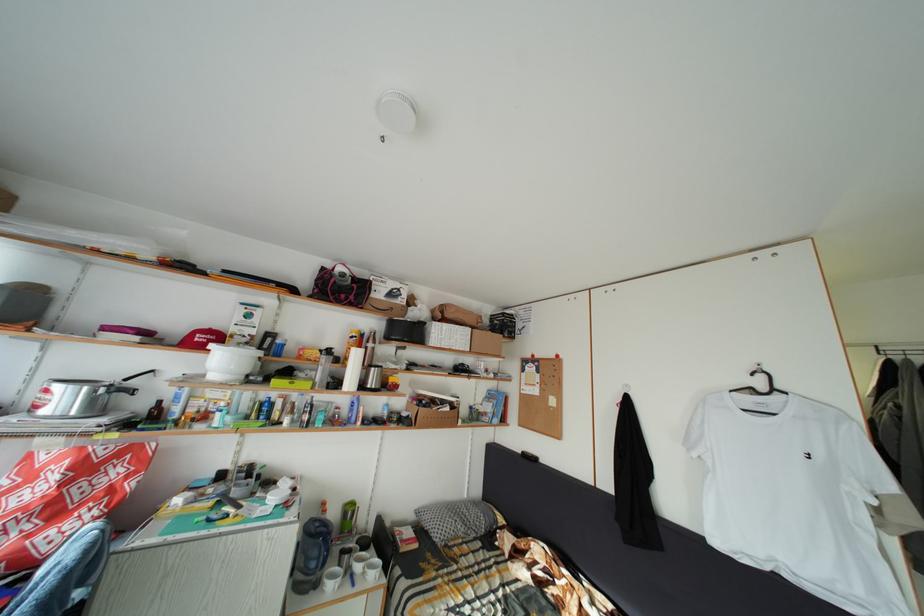
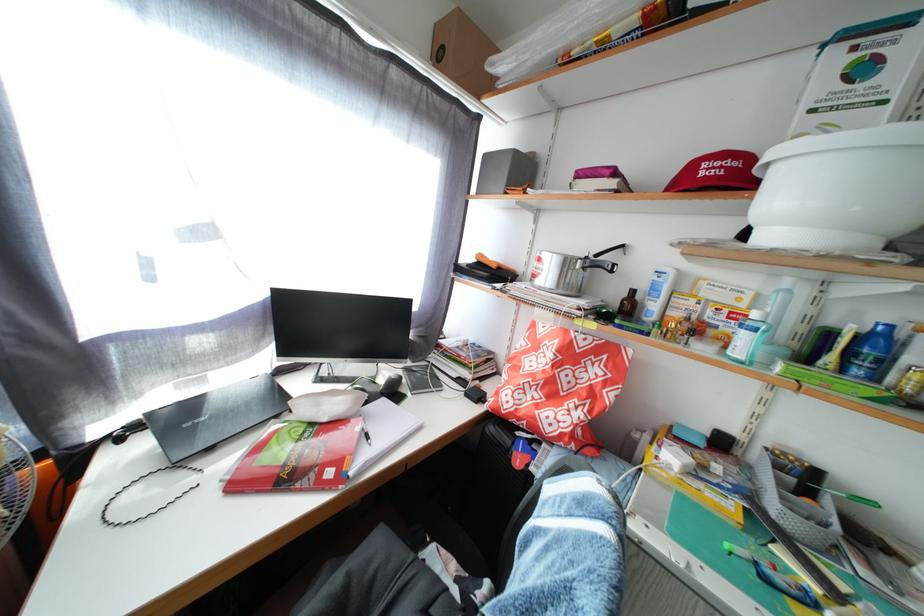
Find the pixel in the second image that matches (271,424) in the first image.

(866, 378)